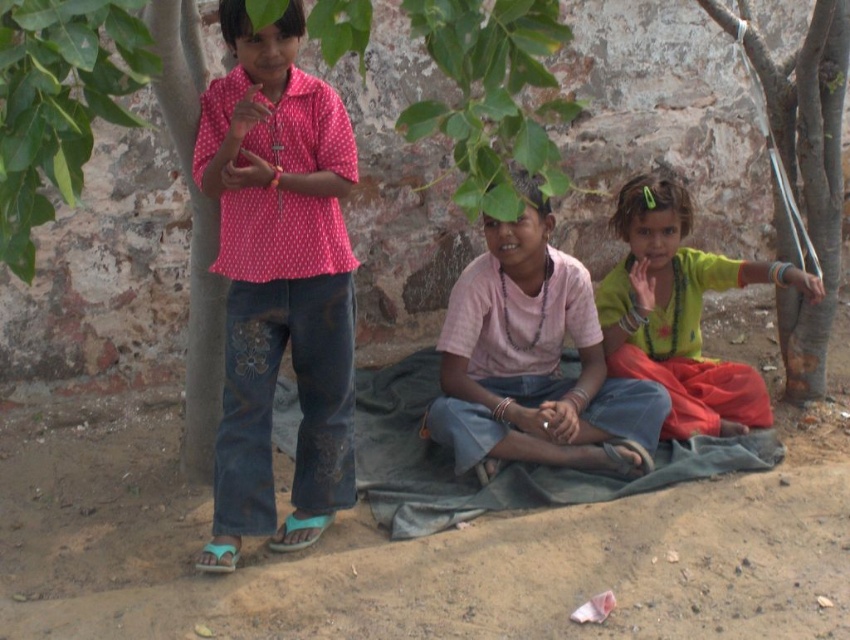
You are a photographer trying to capture a closeup of the dark green fabric at lower center without including the brown sandy ground at lower center in the frame. Given their sizes, is this possible?

The brown sandy ground at lower center is larger in size than the dark green fabric at lower center, so it may be challenging to frame the dark green fabric without including some of the brown sandy ground at lower center due to its larger presence.

You are a photographer trying to capture a candid shot of the two children sitting on the green fabric at right and the pink cotton shirt at center. Your camera has a maximum focus range of 16 inches. Can you capture both subjects in focus without moving the camera?

The distance between the pink cotton shirt at center and the green fabric at right is 16.27 inches, which exceeds the camera maximum focus range of 16 inches. Therefore, the photographer cannot capture both subjects in focus without moving the camera.